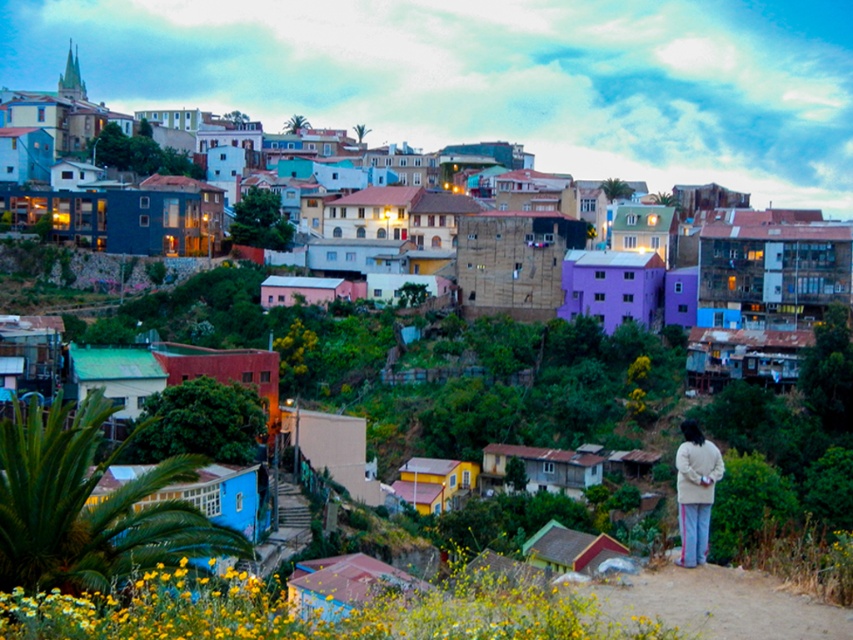
Question: Can you confirm if vivid pastel houses at center is thinner than light beige sweater at lower right?

Choices:
 (A) yes
 (B) no

Answer: (B)

Question: Can you confirm if vivid pastel houses at center is thinner than light beige sweater at lower right?

Choices:
 (A) no
 (B) yes

Answer: (A)

Question: Does vivid pastel houses at center appear on the left side of light beige sweater at lower right?

Choices:
 (A) yes
 (B) no

Answer: (B)

Question: Which of the following is the farthest from the observer?

Choices:
 (A) vivid pastel houses at center
 (B) light beige sweater at lower right

Answer: (A)